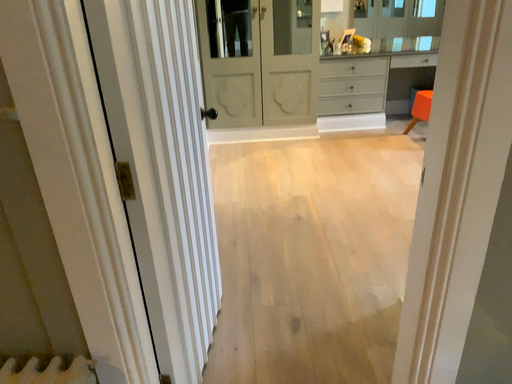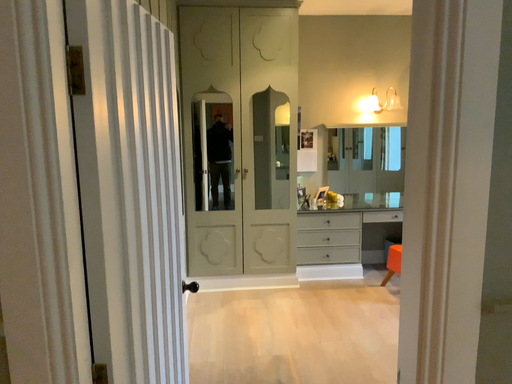
Question: How did the camera likely rotate when shooting the video?

Choices:
 (A) rotated downward
 (B) rotated upward

Answer: (B)